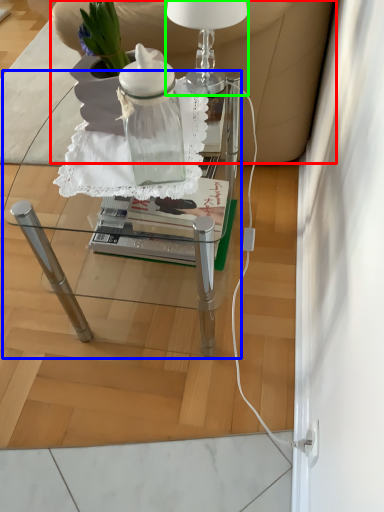
Question: Estimate the real-world distances between objects in this image. Which object is closer to armchair (highlighted by a red box), table (highlighted by a blue box) or table lamp (highlighted by a green box)?

Choices:
 (A) table
 (B) table lamp

Answer: (B)